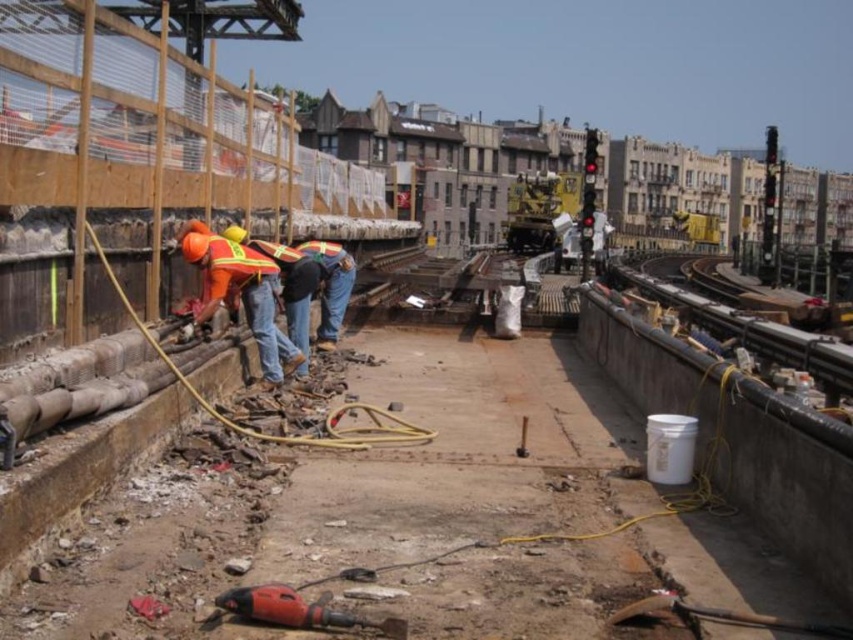
You are a construction worker standing at the edge of the platform looking towards the debris. There are two points marked on the ground where you need to place safety cones. The coordinates are point 1 at [300,621] and point 2 at [236,244]. Which point is closer to you so you can place the cone first?

Point 1 at [300,621] is closer to the camera than point 2 at [236,244], so you should place the cone at point 1 first since it is nearer to your current position.